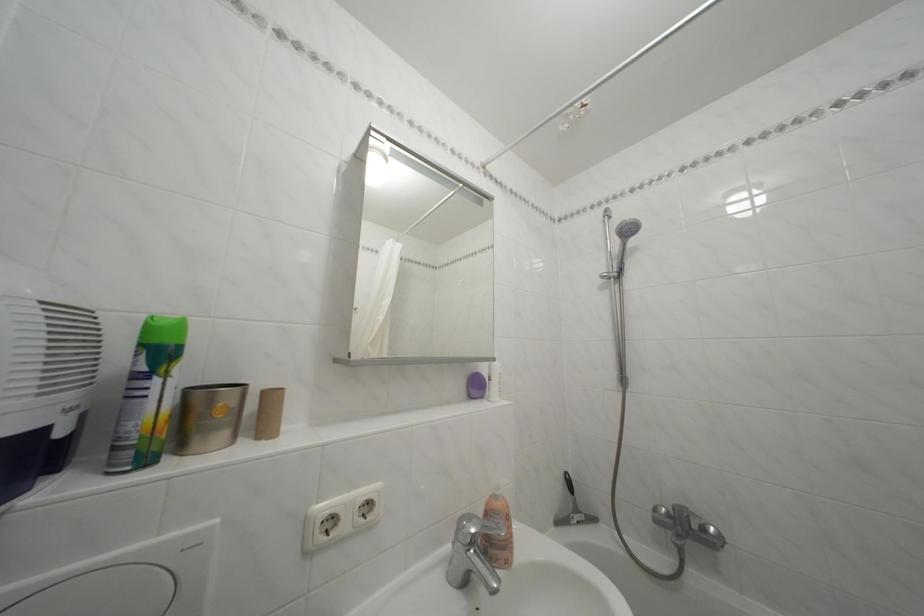
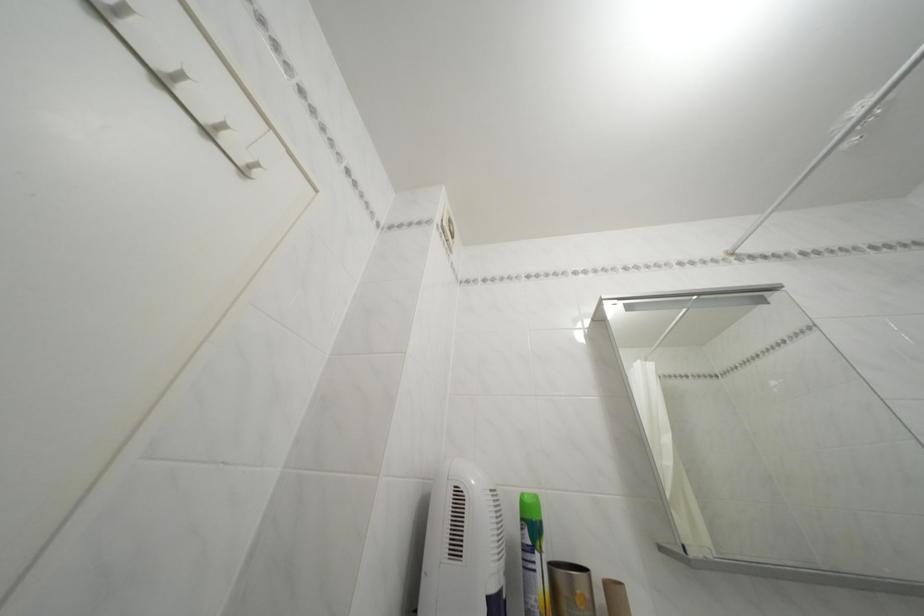
Find the pixel in the second image that matches the point at 165,387 in the first image.

(545, 562)